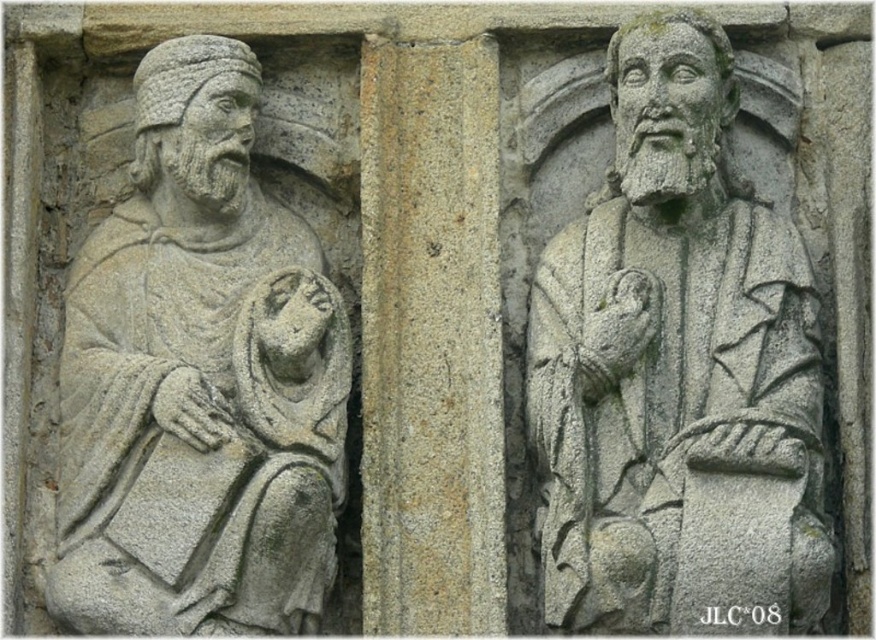
Does gray stone sculpture at right appear over gray stone figure at left?

Correct, gray stone sculpture at right is located above gray stone figure at left.

Where is `gray stone sculpture at right`? The height and width of the screenshot is (640, 876). gray stone sculpture at right is located at coordinates (677, 372).